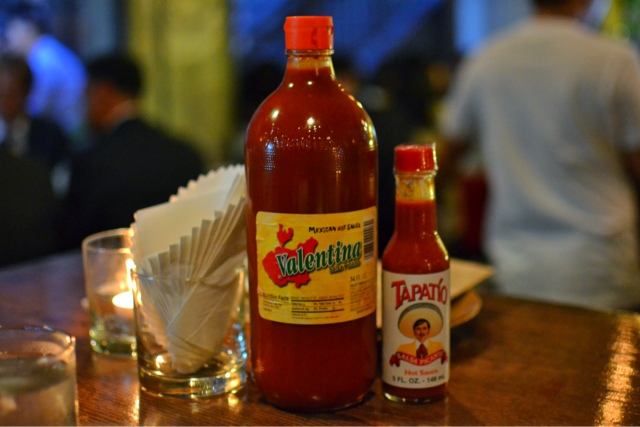
You are a GUI agent. You are given a task and a screenshot of the screen. Output one action in this format:
    pyautogui.click(x=<x>, y=<y>)
    Task: Click on the dark yellow wall pillar
    This screenshot has height=427, width=640.
    Given the screenshot: What is the action you would take?
    (179, 59)